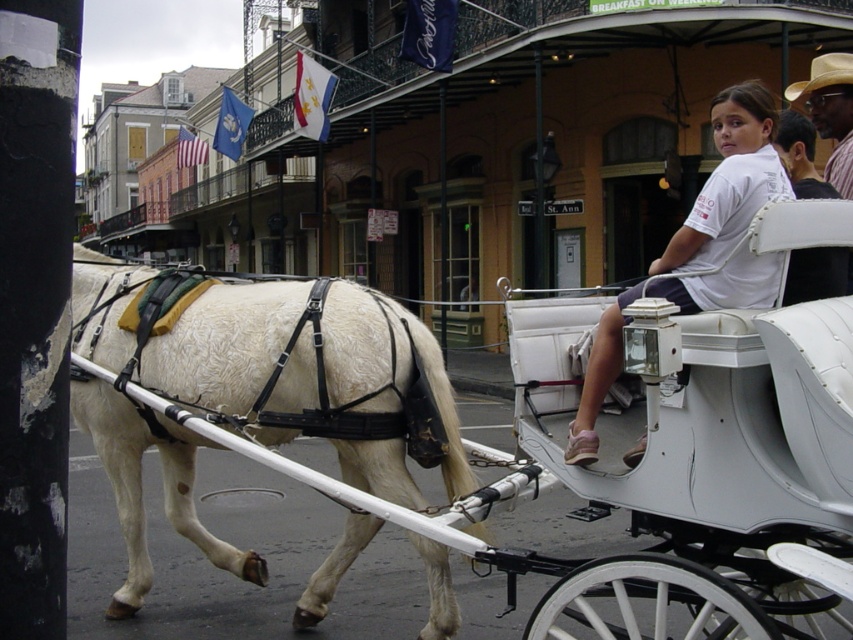
Can you confirm if white leather horse cart at center is positioned to the left of white textured horse at left?

No, white leather horse cart at center is not to the left of white textured horse at left.

Who is more distant from viewer, (x=628, y=556) or (x=250, y=554)?

Point (x=250, y=554)

Looking at this image, who is more forward, [525,376] or [181,470]?

Point [525,376] is in front.

Locate an element on the screen. white leather horse cart at center is located at coordinates (675, 476).

Is white leather horse cart at center further to the viewer compared to white cotton shirt at upper right?

No, it is not.

Is point (727, 456) in front of point (602, 355)?

Yes, it is.

I want to click on white leather horse cart at center, so click(x=675, y=476).

Is white textured horse at left further to the viewer compared to tan straw hat at upper right?

No.

At what (x,y) coordinates should I click in order to perform the action: click on white textured horse at left. Please return your answer as a coordinate pair (x, y). Looking at the image, I should click on (225, 342).

Find the location of `white textured horse at left`. white textured horse at left is located at coordinates (225, 342).